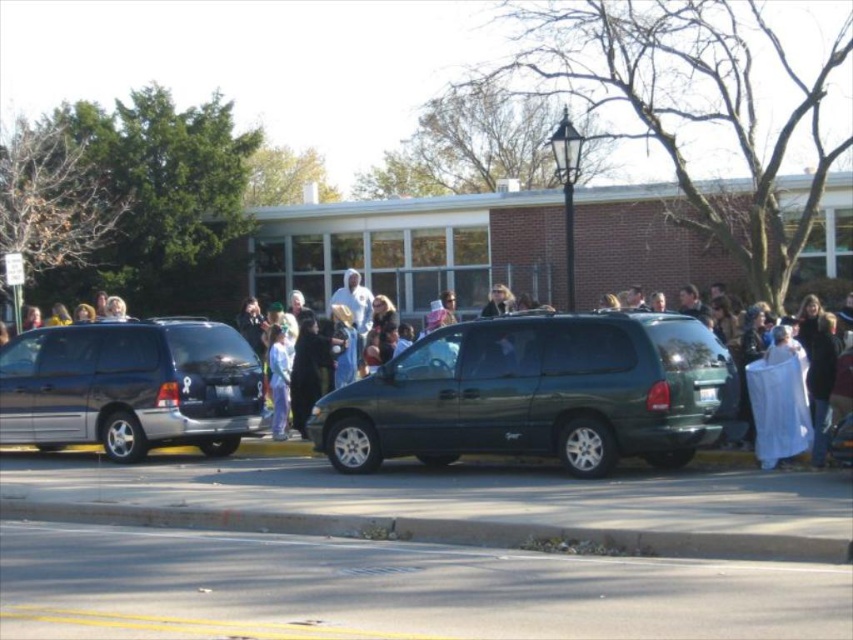
Question: Which is farther from the green matte van at center?

Choices:
 (A) matte black clothing at center
 (B) smooth concrete curb at lower center

Answer: (B)

Question: Based on their relative distances, which object is nearer to the shiny metallic minivan at center?

Choices:
 (A) matte black clothing at center
 (B) green matte van at center
 (C) smooth concrete curb at lower center

Answer: (A)

Question: Which of the following is the farthest from the observer?

Choices:
 (A) (680, 536)
 (B) (25, 406)

Answer: (B)

Question: Is the position of matte black clothing at center less distant than that of green matte van at center?

Choices:
 (A) no
 (B) yes

Answer: (A)

Question: Observing the image, what is the correct spatial positioning of shiny metallic minivan at center in reference to smooth concrete curb at lower center?

Choices:
 (A) left
 (B) right

Answer: (A)

Question: Considering the relative positions of shiny metallic minivan at center and smooth concrete curb at lower center in the image provided, where is shiny metallic minivan at center located with respect to smooth concrete curb at lower center?

Choices:
 (A) below
 (B) above

Answer: (B)